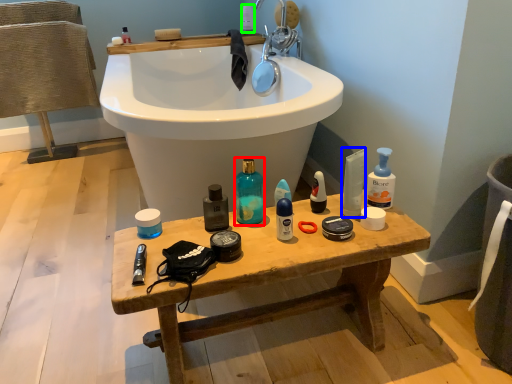
Question: Estimate the real-world distances between objects in this image. Which object is closer to cleaning product (highlighted by a red box), cleaning product (highlighted by a blue box) or toiletry (highlighted by a green box)?

Choices:
 (A) cleaning product
 (B) toiletry

Answer: (A)